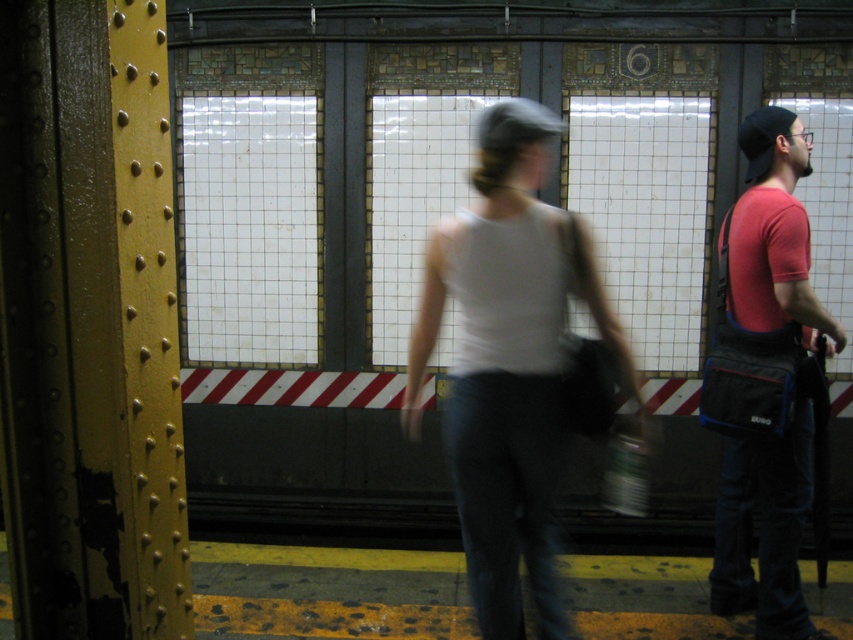
Is point (572, 212) farther from camera compared to point (770, 250)?

That is False.

Is white matte tank top at center below red fabric bag at right?

Yes, white matte tank top at center is below red fabric bag at right.

The width and height of the screenshot is (853, 640). In order to click on white matte tank top at center in this screenshot , I will do `click(509, 362)`.

I want to click on white matte tank top at center, so click(509, 362).